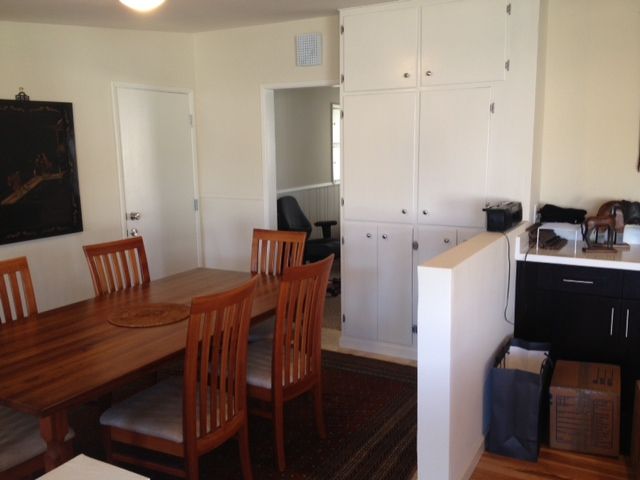
In order to click on drawer in this screenshot , I will do `click(609, 287)`.